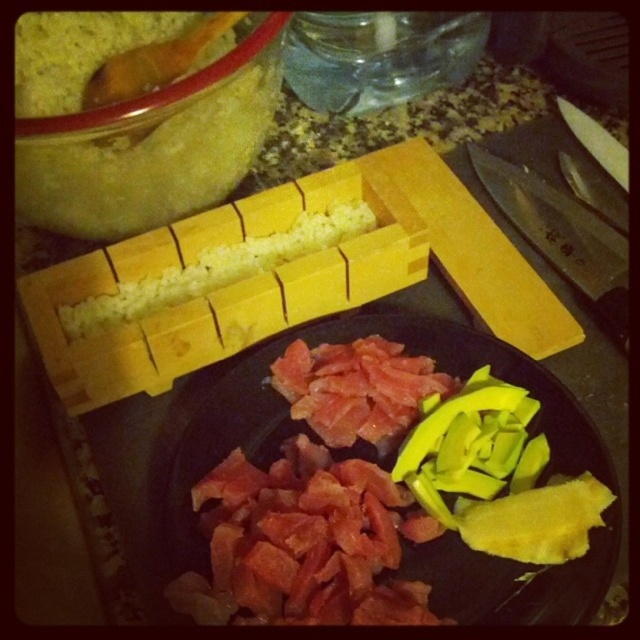
Question: Estimate the real-world distances between objects in this image. Which object is closer to the pinkish-red raw fish at center?

Choices:
 (A) yellow rice at center
 (B) yellow smooth avocado at lower right

Answer: (B)

Question: Which object appears closest to the camera in this image?

Choices:
 (A) yellow rice at center
 (B) pinkish-red raw fish at center
 (C) yellow smooth avocado at lower right

Answer: (B)

Question: Is pinkish-red raw fish at center to the left of yellow smooth avocado at lower right from the viewer's perspective?

Choices:
 (A) no
 (B) yes

Answer: (B)

Question: Is yellow smooth avocado at lower right wider than yellow rice at center?

Choices:
 (A) no
 (B) yes

Answer: (A)

Question: Is pinkish-red raw fish at center positioned before yellow smooth avocado at lower right?

Choices:
 (A) no
 (B) yes

Answer: (B)

Question: Which of these objects is positioned farthest from the yellow smooth avocado at lower right?

Choices:
 (A) pinkish-red raw fish at center
 (B) yellow rice at center

Answer: (B)